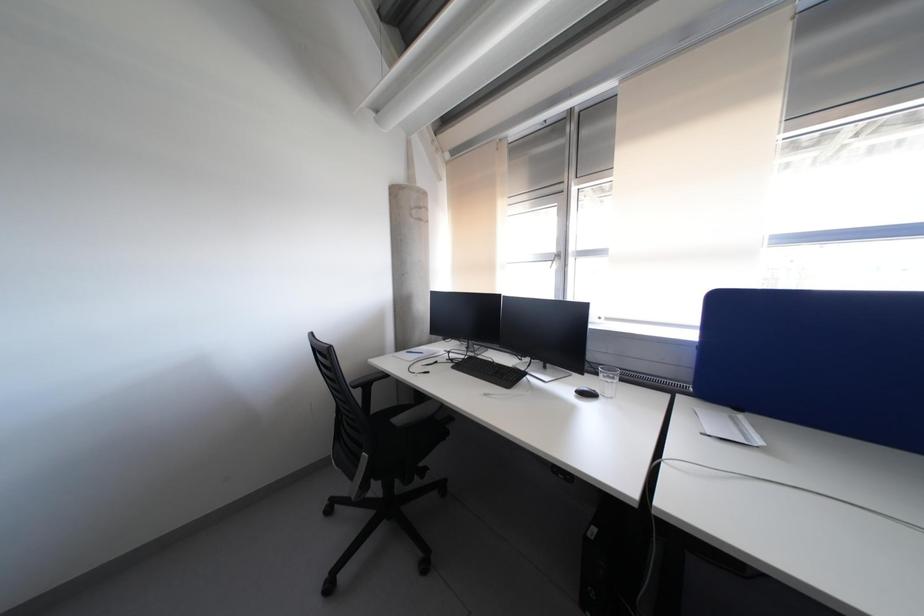
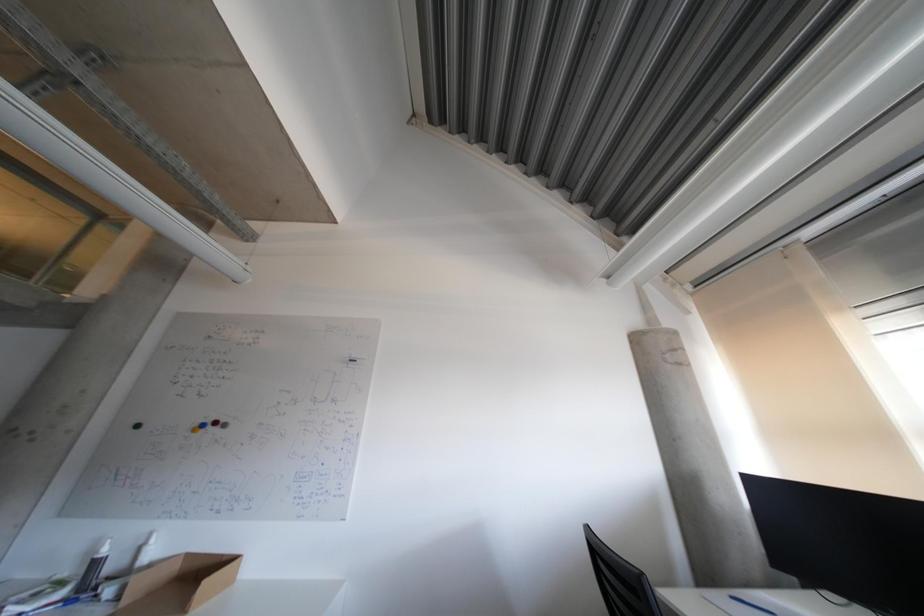
The first image is from the beginning of the video and the second image is from the end. How did the camera likely rotate when shooting the video?

The camera's rotation is toward left-up.